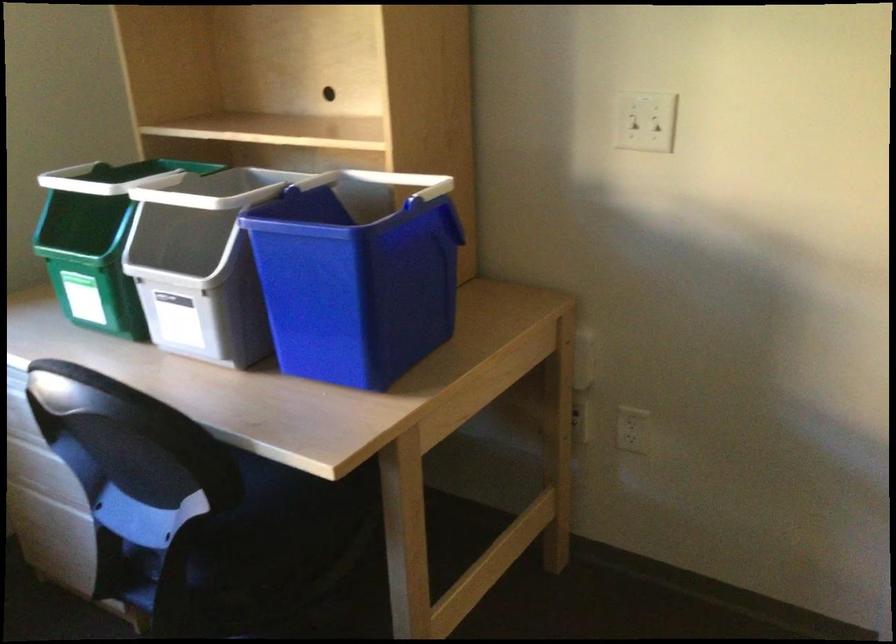
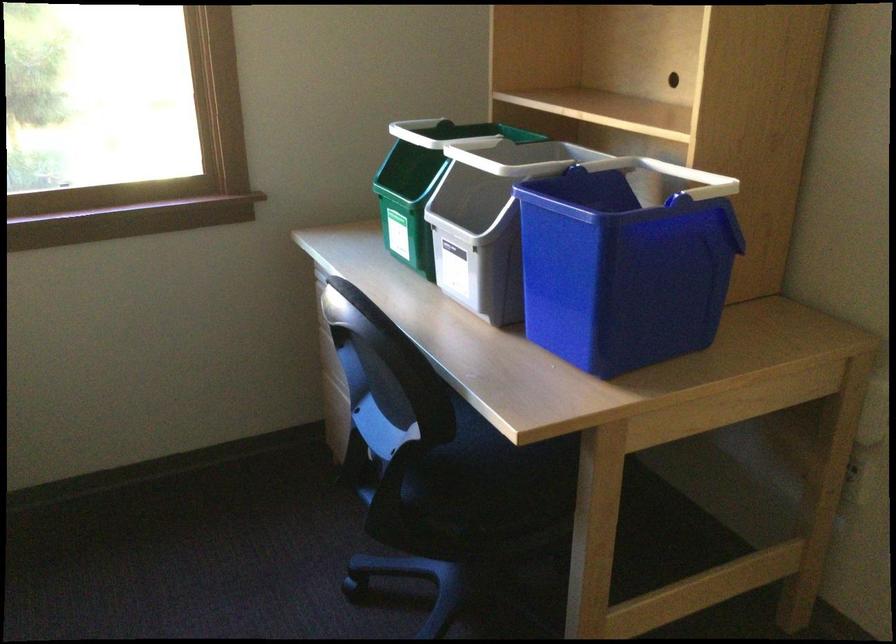
Find the pixel in the second image that matches point 254,558 in the first image.

(460, 494)